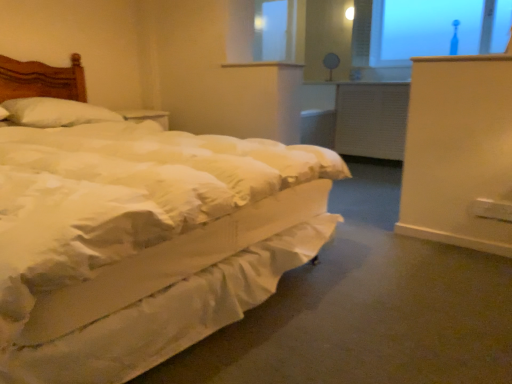
Question: Is white textured radiator at center shorter than matte white table lamp at upper center?

Choices:
 (A) no
 (B) yes

Answer: (A)

Question: Is white textured radiator at center further to the viewer compared to matte white table lamp at upper center?

Choices:
 (A) yes
 (B) no

Answer: (B)

Question: Is white textured radiator at center aimed at matte white table lamp at upper center?

Choices:
 (A) no
 (B) yes

Answer: (A)

Question: Is white textured radiator at center thinner than matte white table lamp at upper center?

Choices:
 (A) no
 (B) yes

Answer: (A)

Question: Are white textured radiator at center and matte white table lamp at upper center beside each other?

Choices:
 (A) no
 (B) yes

Answer: (A)

Question: Is white textured radiator at center far from matte white table lamp at upper center?

Choices:
 (A) no
 (B) yes

Answer: (A)

Question: Is white soft pillow at left facing away from transparent glass window at upper right?

Choices:
 (A) yes
 (B) no

Answer: (B)

Question: From a real-world perspective, is white soft pillow at left positioned over transparent glass window at upper right based on gravity?

Choices:
 (A) no
 (B) yes

Answer: (A)

Question: Is white soft pillow at left oriented towards transparent glass window at upper right?

Choices:
 (A) no
 (B) yes

Answer: (A)

Question: Is white soft pillow at left beside transparent glass window at upper right?

Choices:
 (A) yes
 (B) no

Answer: (B)

Question: Is white soft pillow at left not near transparent glass window at upper right?

Choices:
 (A) yes
 (B) no

Answer: (A)

Question: From the image's perspective, is white soft pillow at left over transparent glass window at upper right?

Choices:
 (A) yes
 (B) no

Answer: (B)

Question: Does transparent glass window at upper right lie behind white soft pillow at left?

Choices:
 (A) no
 (B) yes

Answer: (B)